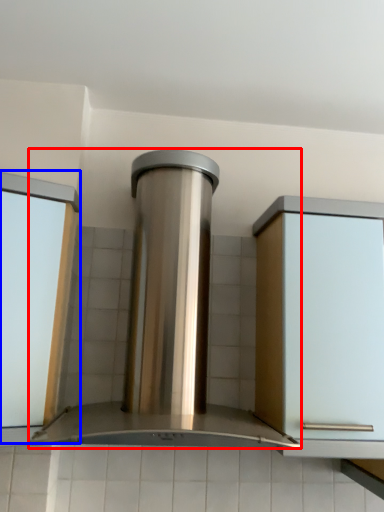
Question: Among these objects, which one is nearest to the camera, home appliance (highlighted by a red box) or window frame (highlighted by a blue box)?

Choices:
 (A) home appliance
 (B) window frame

Answer: (A)